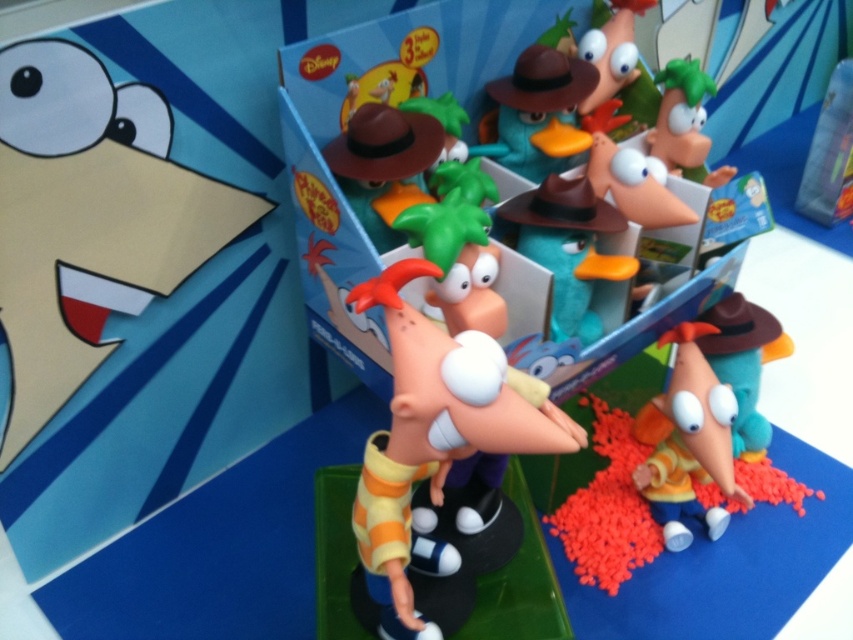
You are a child trying to reach for the yellow matte duck at upper left and the matte plastic toy at center. Which toy can you grab first without moving your hand?

The yellow matte duck at upper left is closer to you than the matte plastic toy at center, so you can grab it first without moving your hand.

Consider the image. You are a toy store employee arranging the Phineas and Ferb display. The store manager has specified that all toys must be placed within a designated area defined by coordinates between 0.5 and 0.7 on the horizontal axis and 0.4 and 0.6 on the vertical axis. Is the matte plastic toy at center positioned correctly according to these guidelines?

The matte plastic toy at center is at point [434,433]. The horizontal coordinate 0.678 falls within the 0.5 to 0.7 range, and the vertical coordinate 0.511 is within the 0.4 to 0.6 range. Therefore, the toy is positioned correctly within the designated area.

You are a collector organizing a display case for Phineas and Ferb toys. You have a yellow matte toy at center and a matte brown hat at upper center. Which object is located higher in the display case?

The matte brown hat at upper center is located higher in the display case than the yellow matte toy at center.